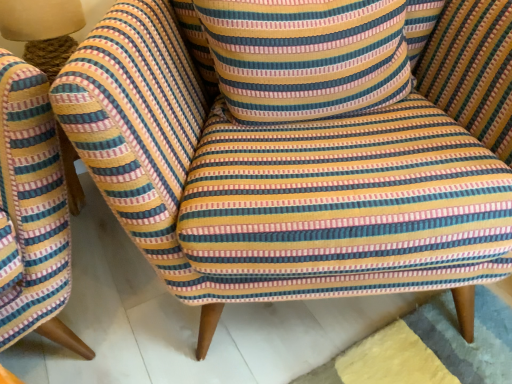
Question: Should I look upward or downward to see matte beige lampshade at upper left?

Choices:
 (A) down
 (B) up

Answer: (B)

Question: Is matte beige lampshade at upper left to the left of striped fabric pillow at center from the viewer's perspective?

Choices:
 (A) no
 (B) yes

Answer: (B)

Question: Does matte beige lampshade at upper left appear on the right side of striped fabric pillow at center?

Choices:
 (A) no
 (B) yes

Answer: (A)

Question: From a real-world perspective, is matte beige lampshade at upper left on top of striped fabric pillow at center?

Choices:
 (A) yes
 (B) no

Answer: (B)

Question: Is striped fabric pillow at center a part of matte beige lampshade at upper left?

Choices:
 (A) no
 (B) yes

Answer: (A)

Question: Is matte beige lampshade at upper left beside striped fabric pillow at center?

Choices:
 (A) no
 (B) yes

Answer: (A)

Question: Can you confirm if matte beige lampshade at upper left is smaller than striped fabric pillow at center?

Choices:
 (A) yes
 (B) no

Answer: (A)

Question: Is striped fabric pillow at center shorter than matte beige lampshade at upper left?

Choices:
 (A) yes
 (B) no

Answer: (B)

Question: Can you confirm if striped fabric pillow at center is bigger than matte beige lampshade at upper left?

Choices:
 (A) no
 (B) yes

Answer: (B)

Question: Considering the relative sizes of striped fabric pillow at center and matte beige lampshade at upper left in the image provided, is striped fabric pillow at center thinner than matte beige lampshade at upper left?

Choices:
 (A) yes
 (B) no

Answer: (B)

Question: From a real-world perspective, is striped fabric pillow at center located higher than matte beige lampshade at upper left?

Choices:
 (A) yes
 (B) no

Answer: (A)

Question: Is matte beige lampshade at upper left at the back of striped fabric pillow at center?

Choices:
 (A) yes
 (B) no

Answer: (B)

Question: From a real-world perspective, is striped fabric pillow at center located beneath matte beige lampshade at upper left?

Choices:
 (A) yes
 (B) no

Answer: (B)

Question: Is striped fabric pillow at center taller or shorter than matte beige lampshade at upper left?

Choices:
 (A) short
 (B) tall

Answer: (B)